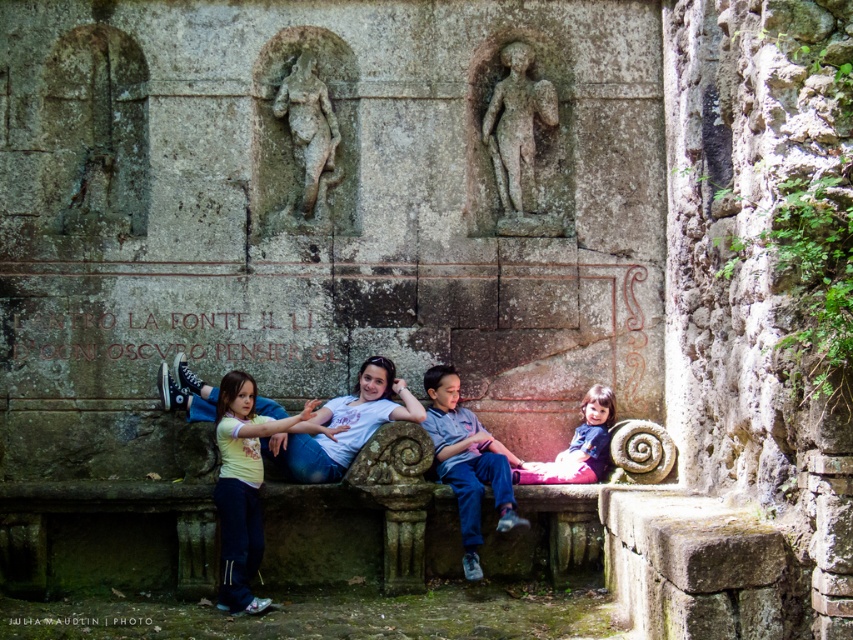
Is matte white t-shirt at center to the left of gray stone reclining figure at center from the viewer's perspective?

In fact, matte white t-shirt at center is to the right of gray stone reclining figure at center.

Who is more distant from viewer, (281, 451) or (291, 74)?

The point (291, 74) is more distant.

Find the location of a particular element. This screenshot has height=640, width=853. matte white t-shirt at center is located at coordinates (344, 424).

Is point (512, 460) in front of point (323, 109)?

That is True.

Between point (442, 432) and point (286, 106), which one is positioned behind?

The point (286, 106) is more distant.

Is point (467, 568) positioned in front of point (312, 70)?

Yes.

This screenshot has width=853, height=640. I want to click on matte gray stone bench at center, so 467,461.

Is yellow cotton shirt at center thinner than gray stone reclining figure at center?

Yes.

Who is more forward, (257, 557) or (322, 157)?

Point (257, 557) is in front.

This screenshot has width=853, height=640. I want to click on yellow cotton shirt at center, so click(x=242, y=486).